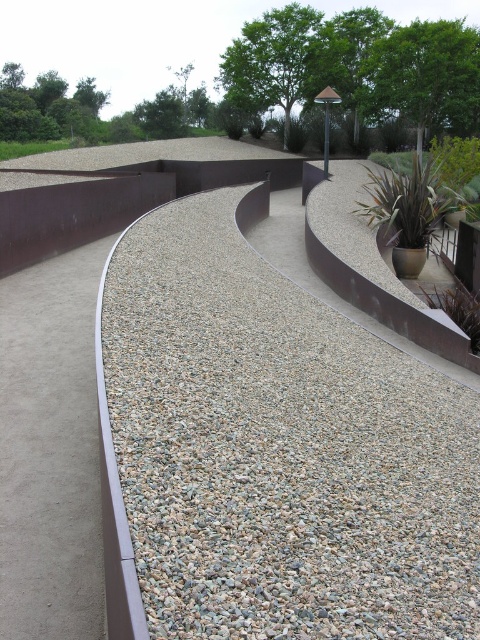
Question: Which object is positioned farthest from the gray gravel at center?

Choices:
 (A) green leafy plant at upper left
 (B) purple leafy plant at center-right

Answer: (A)

Question: Which object appears closest to the camera in this image?

Choices:
 (A) gray gravel at center
 (B) purple leafy plant at center-right
 (C) green leafy plant at upper left

Answer: (A)

Question: Can you confirm if gray gravel at center is positioned to the right of green leafy plant at upper left?

Choices:
 (A) yes
 (B) no

Answer: (A)

Question: Is purple leafy plant at center-right positioned at the back of green leafy plant at upper left?

Choices:
 (A) yes
 (B) no

Answer: (B)

Question: Is gray gravel at center to the right of green leafy plant at upper left from the viewer's perspective?

Choices:
 (A) no
 (B) yes

Answer: (B)

Question: Which object appears closest to the camera in this image?

Choices:
 (A) purple leafy plant at center-right
 (B) green leafy plant at upper left

Answer: (A)